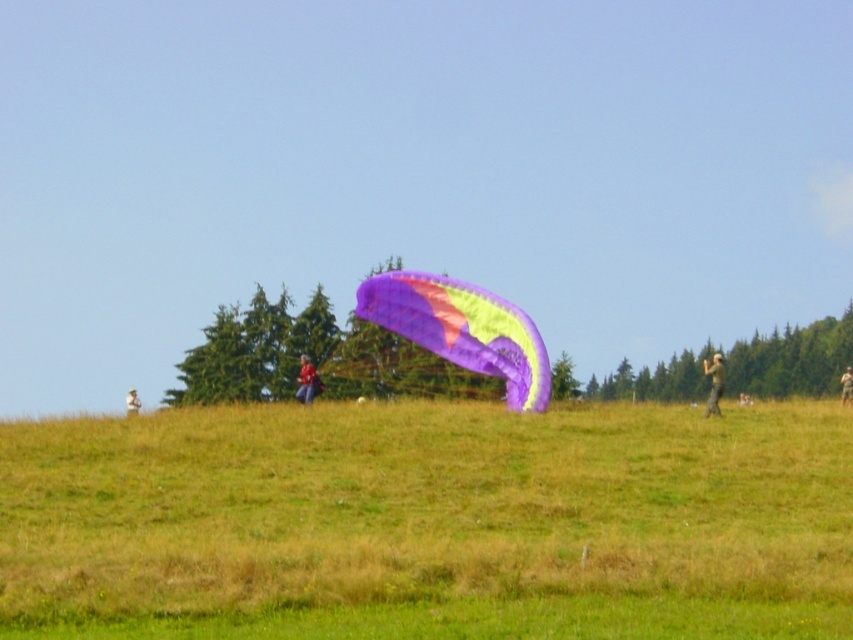
Question: Which of the following is the closest to the observer?

Choices:
 (A) (705, 413)
 (B) (279, 481)

Answer: (B)

Question: From the image, what is the correct spatial relationship of blurred green pants at center in relation to light brown fabric jacket at center?

Choices:
 (A) left
 (B) right

Answer: (B)

Question: Which of the following is the closest to the observer?

Choices:
 (A) camouflage fabric jacket at center
 (B) blurred green pants at center
 (C) translucent purple kite at center

Answer: (B)

Question: Does blurred green pants at center have a lesser width compared to camouflage fabric person at right?

Choices:
 (A) no
 (B) yes

Answer: (A)

Question: Can you confirm if translucent purple kite at center is positioned to the right of light brown fabric jacket at center?

Choices:
 (A) yes
 (B) no

Answer: (A)

Question: Considering the real-world distances, which object is closest to the translucent purple kite at center?

Choices:
 (A) camouflage fabric jacket at center
 (B) camouflage fabric person at right
 (C) blurred green pants at center

Answer: (A)